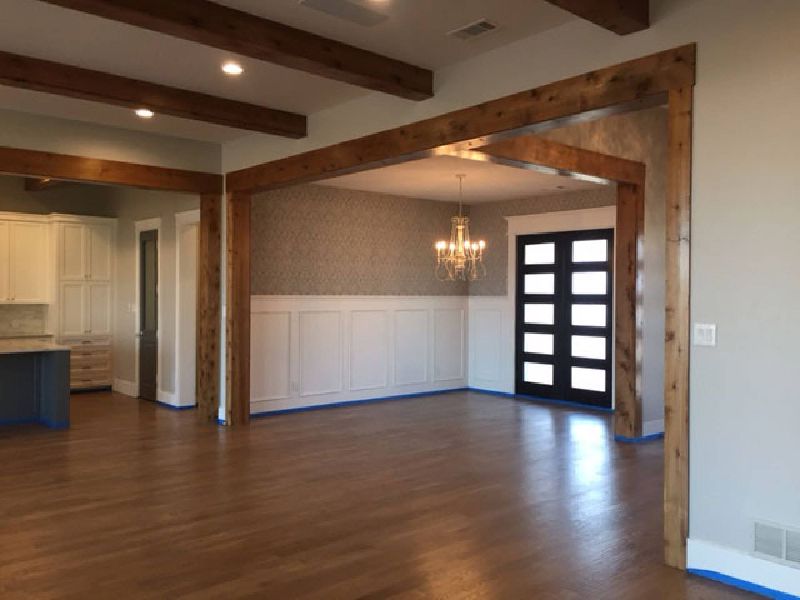
You are a GUI agent. You are given a task and a screenshot of the screen. Output one action in this format:
    pyautogui.click(x=<x>, y=<y>)
    Task: Click on the ceiling
    
    Given the screenshot: What is the action you would take?
    pyautogui.click(x=289, y=79)